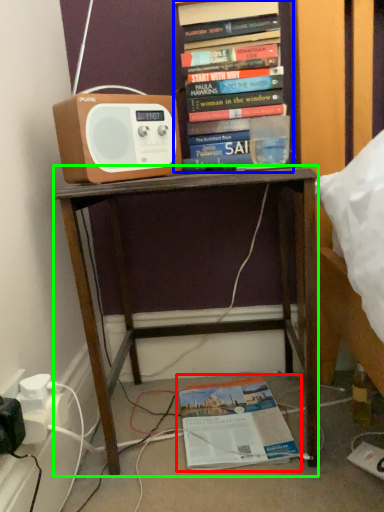
Question: Based on their relative distances, which object is farther from book (highlighted by a red box)? Choose from book (highlighted by a blue box) and desk (highlighted by a green box).

Choices:
 (A) book
 (B) desk

Answer: (A)